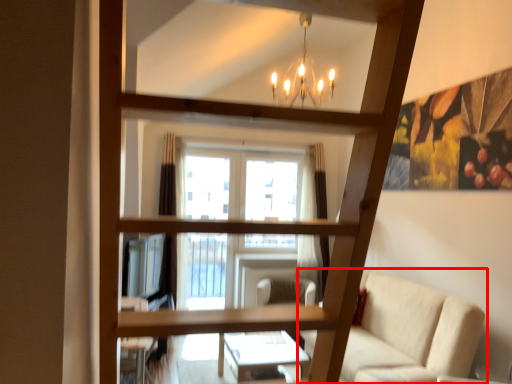
Question: From the image's perspective, what is the correct spatial positioning of studio couch (annotated by the red box) in reference to swivel chair?

Choices:
 (A) above
 (B) below

Answer: (A)